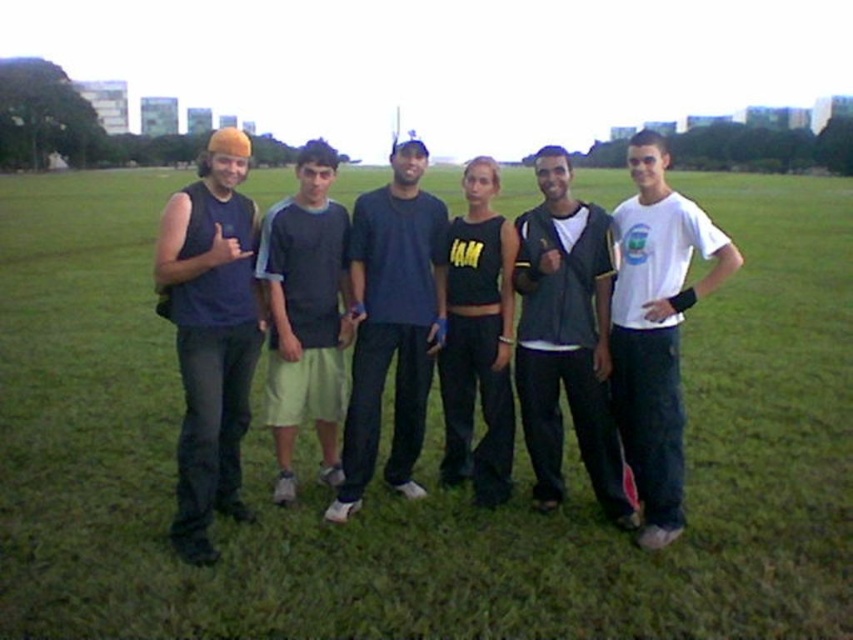
Is point (189, 490) behind point (293, 428)?

No, it is not.

Who is lower down, matte blue tank top at left or light green shorts at center?

Positioned lower is matte blue tank top at left.

Image resolution: width=853 pixels, height=640 pixels. I want to click on matte blue tank top at left, so click(210, 333).

Does point (117, 467) come farther from viewer compared to point (550, 250)?

Yes, point (117, 467) is farther from viewer.

Between point (585, 596) and point (576, 284), which one is positioned in front?

Point (585, 596)

Between point (764, 620) and point (616, 496), which one is positioned in front?

Positioned in front is point (764, 620).

Locate an element on the screen. green grass at center is located at coordinates click(419, 458).

Between matte blue tank top at left and dark blue t-shirt at center, which one is positioned higher?

Positioned higher is dark blue t-shirt at center.

Is matte blue tank top at left shorter than dark blue t-shirt at center?

Yes.

Who is more distant from viewer, (223,342) or (399,314)?

Point (399,314)

Find the location of a particular element. matte blue tank top at left is located at coordinates (210, 333).